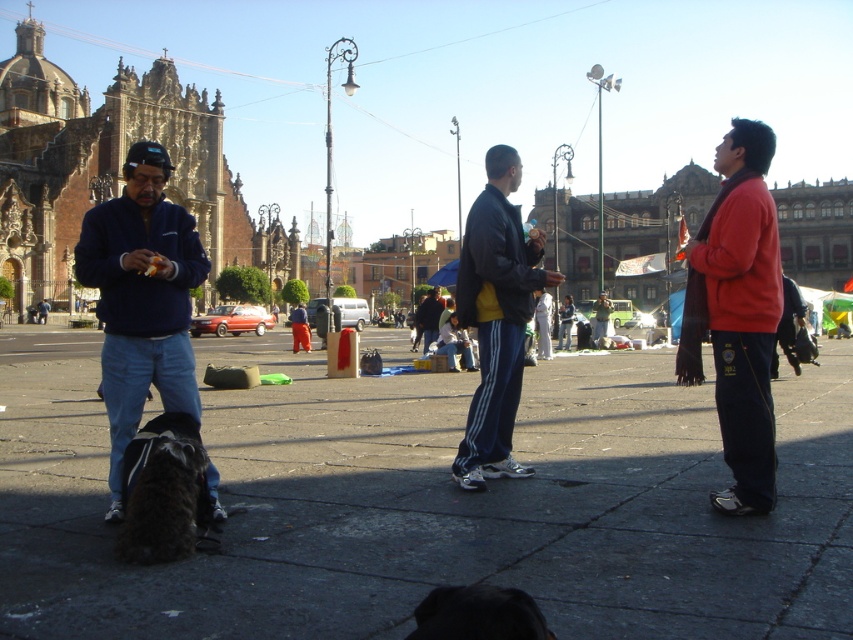
Question: Among these objects, which one is nearest to the camera?

Choices:
 (A) black leather jacket at center
 (B) black fur dog at lower center

Answer: (B)

Question: Which of the following is the closest to the observer?

Choices:
 (A) (451, 612)
 (B) (750, 474)
 (C) (610, 596)

Answer: (A)

Question: Can you confirm if smooth concrete pavement at center is wider than black leather jacket at center?

Choices:
 (A) yes
 (B) no

Answer: (A)

Question: Is red matte jacket at right below black fur dog at lower center?

Choices:
 (A) yes
 (B) no

Answer: (B)

Question: Does red matte jacket at right have a greater width compared to black fur dog at lower center?

Choices:
 (A) yes
 (B) no

Answer: (B)

Question: Among these objects, which one is farthest from the camera?

Choices:
 (A) black fur dog at lower center
 (B) smooth concrete pavement at center
 (C) red matte jacket at right
 (D) black leather jacket at center

Answer: (D)